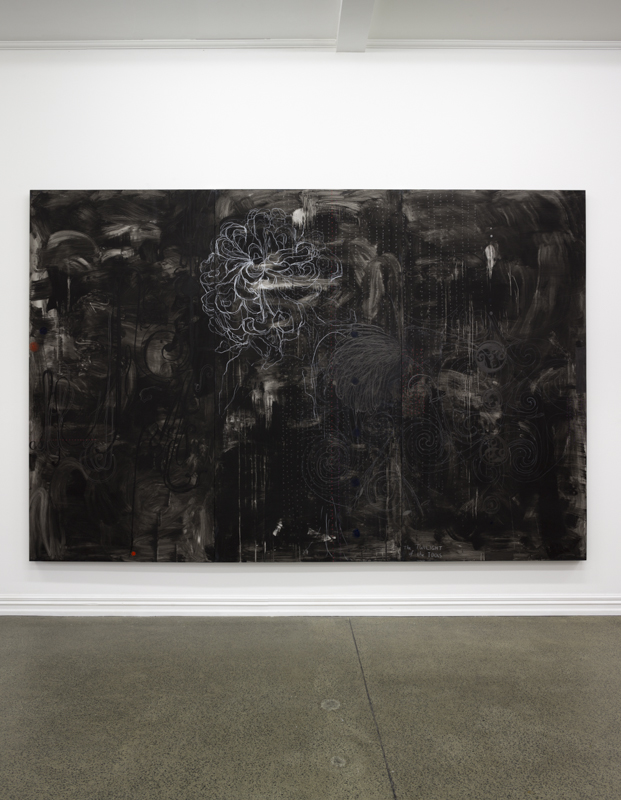
This screenshot has width=621, height=800. I want to click on white wall, so click(x=186, y=146).